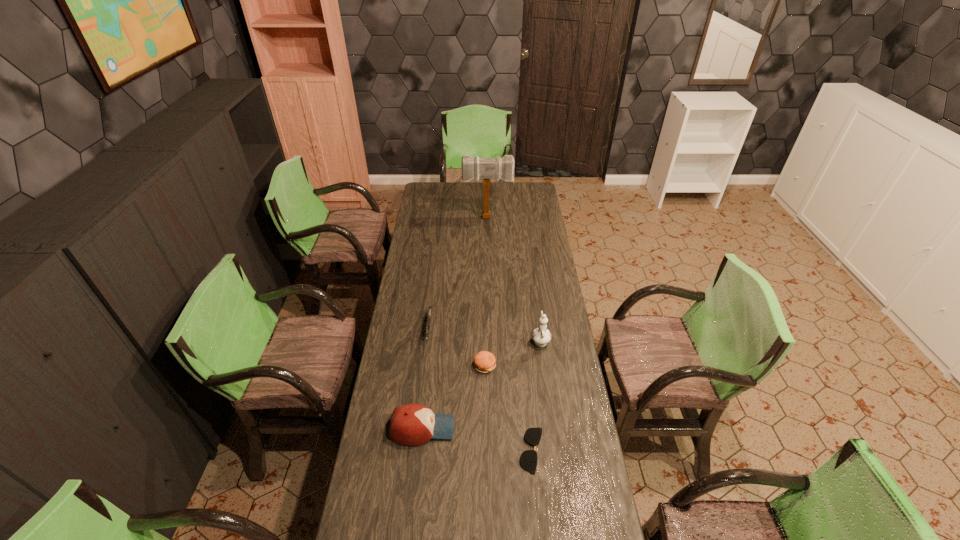
In order to click on free space located 0.220m at the spout of the second tallest object in this screenshot , I will do `click(535, 296)`.

This screenshot has width=960, height=540. In order to click on free space located at the spout of the second tallest object in this screenshot , I will do `click(534, 293)`.

The width and height of the screenshot is (960, 540). I want to click on vacant region located 0.230m on the front-facing side of the fourth shortest object, so click(x=519, y=428).

At what (x,y) coordinates should I click in order to perform the action: click on vacant region located 0.160m aimed along the barrel of the gun. Please return your answer as a coordinate pair (x, y). The width and height of the screenshot is (960, 540). Looking at the image, I should click on (423, 382).

What are the coordinates of `free spot located on the front of the fifth tallest object` in the screenshot? It's located at (486, 438).

Identify the location of free region located on the back of the shortest object. (522, 350).

Image resolution: width=960 pixels, height=540 pixels. I want to click on baseball cap positioned at the left edge, so click(x=413, y=424).

Identify the location of gun that is positioned at the left edge. The height and width of the screenshot is (540, 960). (430, 308).

Identify the location of chinaware that is at the right edge. (541, 335).

Locate an element on the screen. This screenshot has width=960, height=540. spectacles at the right edge is located at coordinates (528, 459).